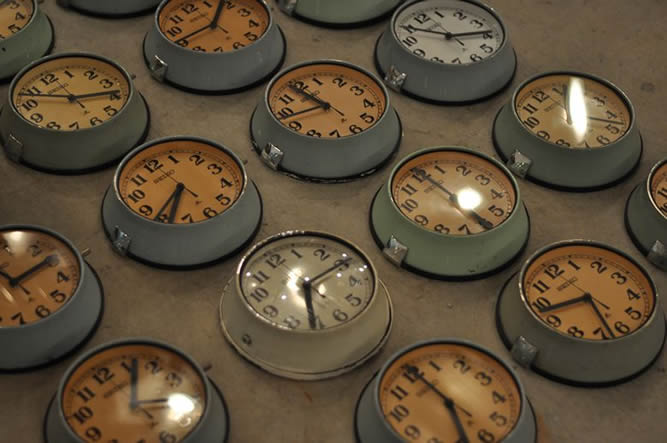
Locate an element on the screen. This screenshot has width=667, height=443. clock 2 is located at coordinates (584, 300).